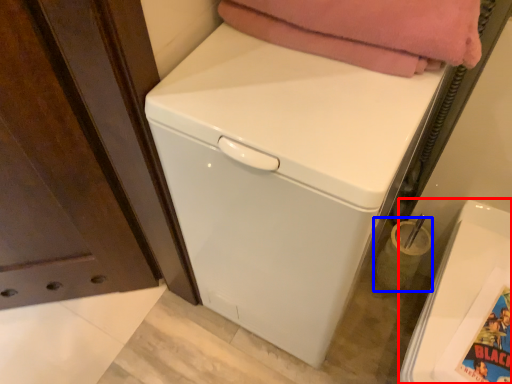
Question: Which of the following is the closest to the observer, washing machine (highlighted by a red box) or appliance (highlighted by a blue box)?

Choices:
 (A) washing machine
 (B) appliance

Answer: (A)